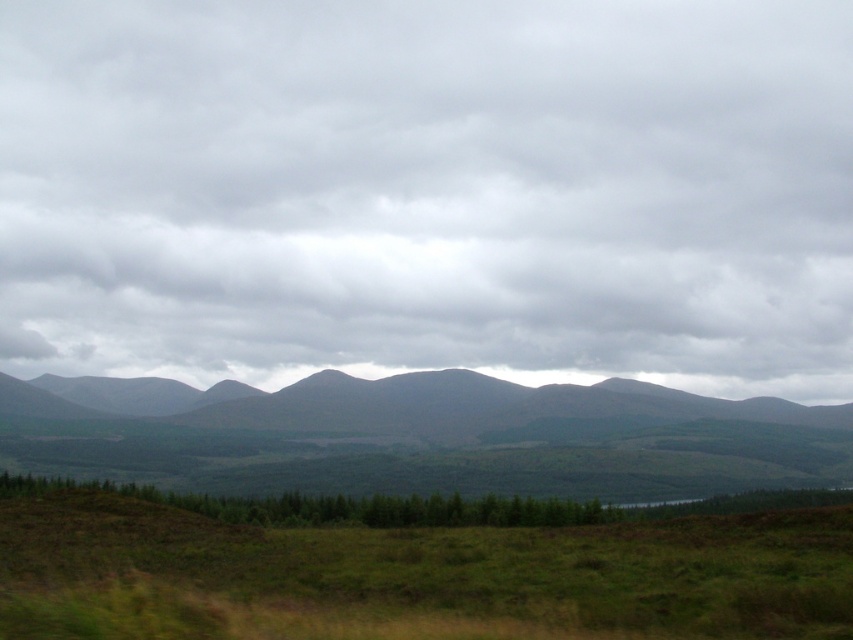
You are standing at the point closer to the camera in this landscape. Which point are you at, point (741,284) or point (71,465)?

You are at point (71,465) because it is closer to the camera than point (741,284).

You are standing on the green grassy field at lower center and want to climb to the top of the gray textured mountains at center. Based on the scene, what challenge might you face due to their height difference?

The green grassy field at lower center has a lesser height compared to the gray textured mountains at center, so climbing to the top of the gray textured mountains at center may be challenging due to their greater elevation.

You are standing in the middle of the green grassy field at lower center and want to reach the gray textured mountains at center. Which direction should you walk to get closer to the mountains?

You should walk forward because the gray textured mountains at center are further away from the green grassy field at lower center, which is closer to you.